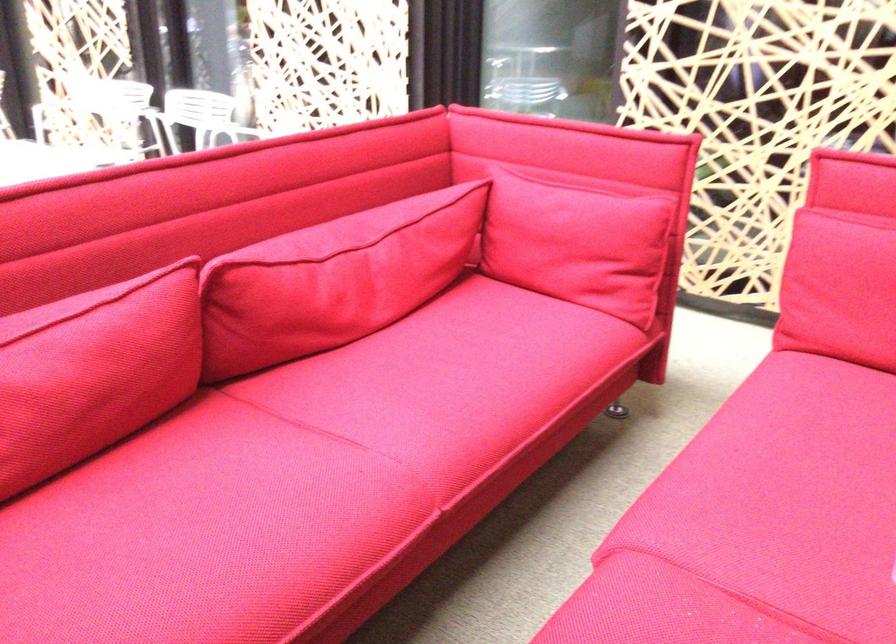
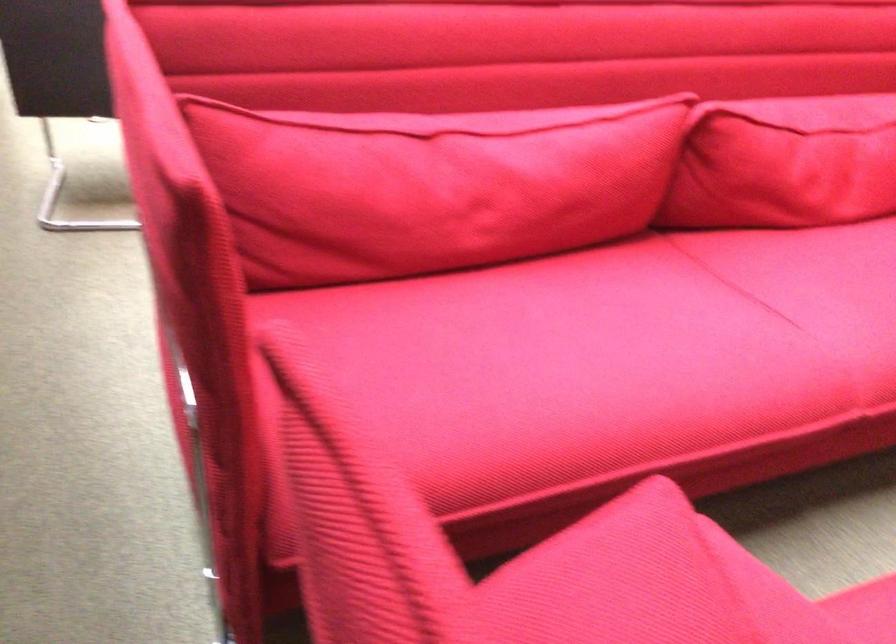
Question: Based on the continuous images, in which direction is the camera rotating? Reply with the corresponding letter.

Choices:
 (A) Left
 (B) Right
 (C) Up
 (D) Down

Answer: (A)